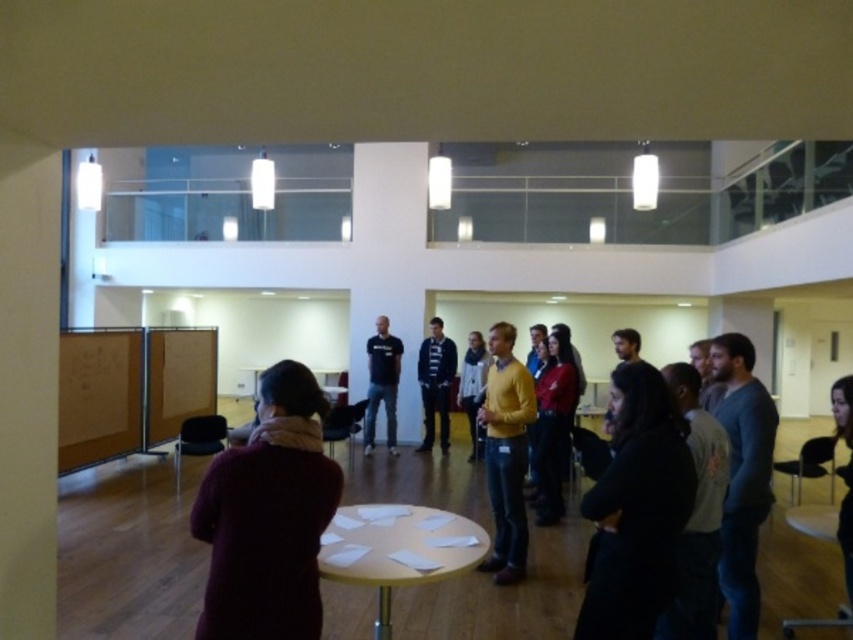
Looking at this image, you are a photographer setting up for a group photo in the office. You need to position yourself so that both the maroon woolen sweater at center and the light brown wooden table at center are visible in your shot. Based on their positions, which object is closer to the camera?

The maroon woolen sweater at center is closer to the camera because it is in front of the light brown wooden table at center.